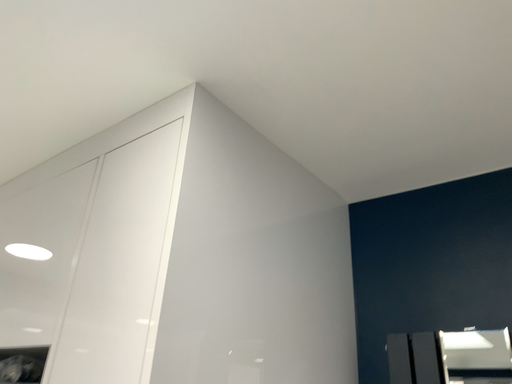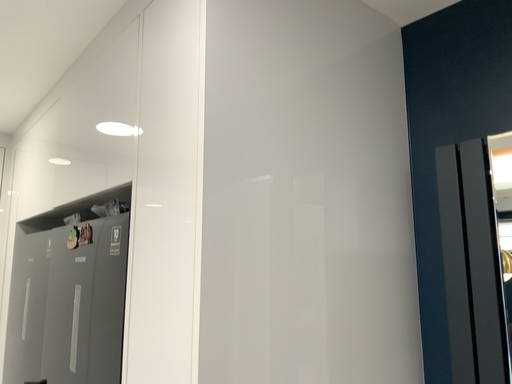
Question: How did the camera likely rotate when shooting the video?

Choices:
 (A) rotated right
 (B) rotated left

Answer: (B)